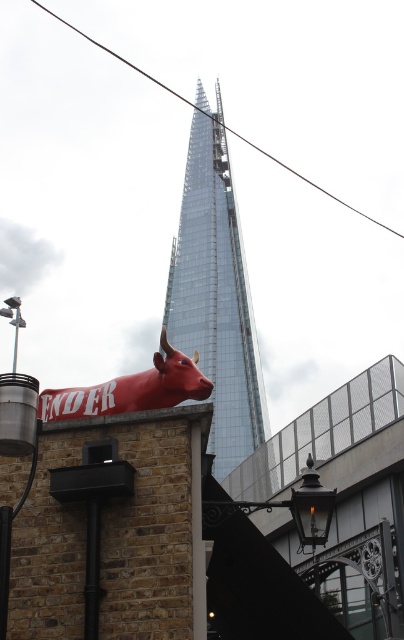
Question: Is transparent glass skyscraper at center above shiny red bull at lower left?

Choices:
 (A) yes
 (B) no

Answer: (A)

Question: Is transparent glass skyscraper at center wider than shiny red bull at lower left?

Choices:
 (A) yes
 (B) no

Answer: (A)

Question: Which point is closer to the camera?

Choices:
 (A) transparent glass skyscraper at center
 (B) shiny red bull at lower left

Answer: (B)

Question: Which object is closer to the camera taking this photo?

Choices:
 (A) transparent glass skyscraper at center
 (B) shiny red bull at lower left

Answer: (B)

Question: Is transparent glass skyscraper at center wider than shiny red bull at lower left?

Choices:
 (A) yes
 (B) no

Answer: (A)